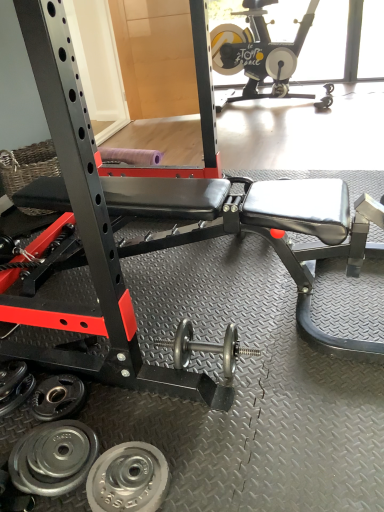
Image resolution: width=384 pixels, height=512 pixels. In order to click on blank space above silver metallic weight plate at lower left, which ranks as the first wheel in front-to-back order (from a real-world perspective) in this screenshot , I will do `click(125, 476)`.